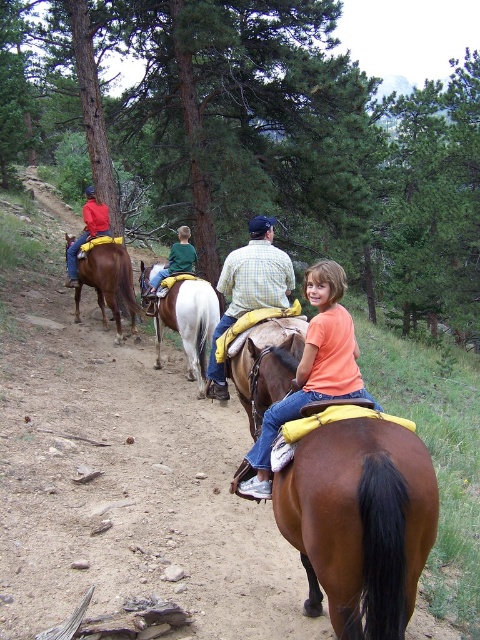
Is matte orange shirt at center to the left of checkered fabric shirt at center from the viewer's perspective?

Incorrect, matte orange shirt at center is not on the left side of checkered fabric shirt at center.

Identify the location of matte orange shirt at center. (310, 372).

You are a GUI agent. You are given a task and a screenshot of the screen. Output one action in this format:
    pyautogui.click(x=<x>, y=<y>)
    Task: Click on the matte orange shirt at center
    The height and width of the screenshot is (640, 480).
    Given the screenshot: What is the action you would take?
    pyautogui.click(x=310, y=372)

Is matte orange shirt at center closer to camera compared to brown leather saddle at left?

Yes, matte orange shirt at center is in front of brown leather saddle at left.

What are the coordinates of `matte orange shirt at center` in the screenshot? It's located at (310, 372).

Is point (266, 436) less distant than point (200, 278)?

That is True.

Locate an element on the screen. The height and width of the screenshot is (640, 480). matte orange shirt at center is located at coordinates (310, 372).

Where is `matte orange shirt at center`? This screenshot has height=640, width=480. matte orange shirt at center is located at coordinates (310, 372).